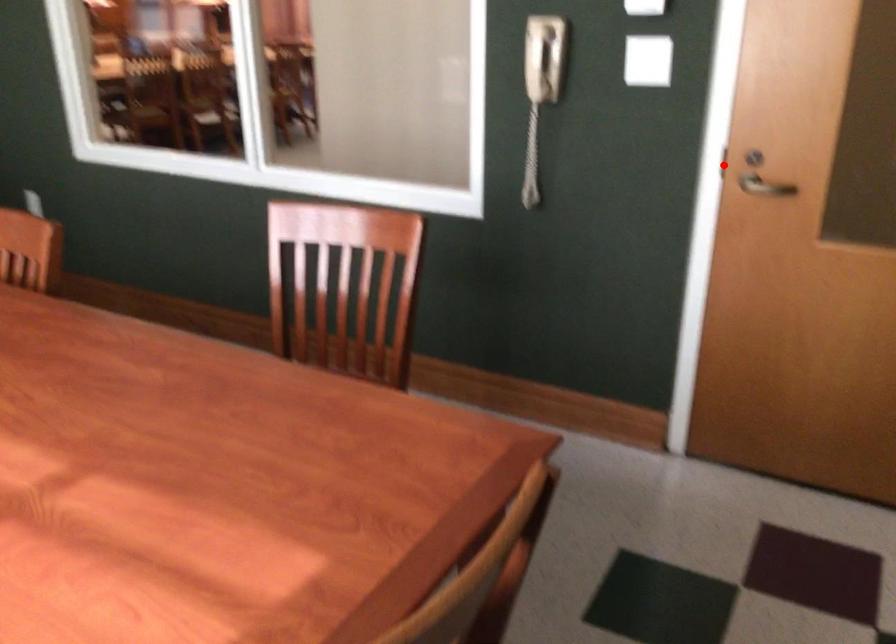
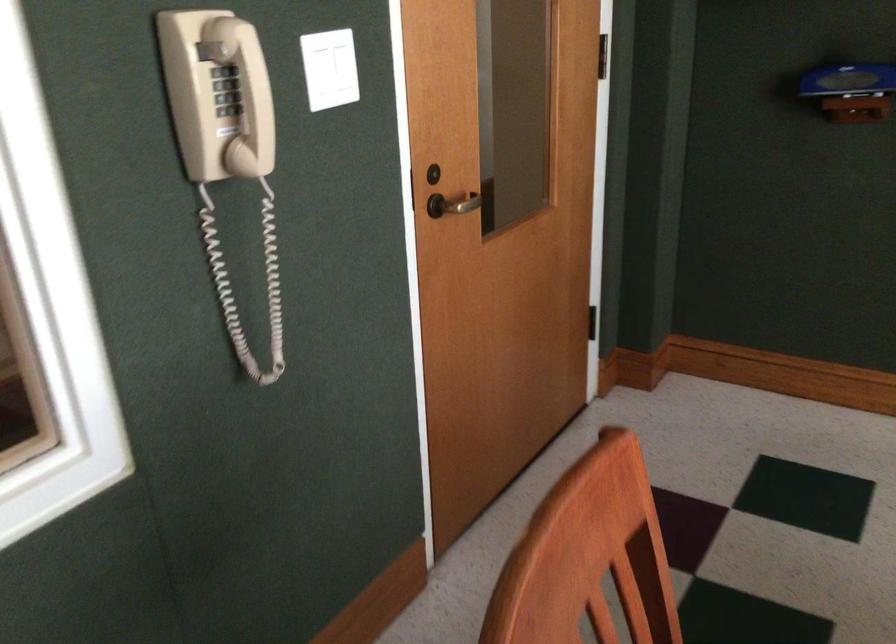
Question: A red point is marked in image1. In image2, is the corresponding 3D point closer to the camera or farther? Reply with the corresponding letter.

Choices:
 (A) The corresponding 3D point is closer.
 (B) The corresponding 3D point is farther.

Answer: (A)